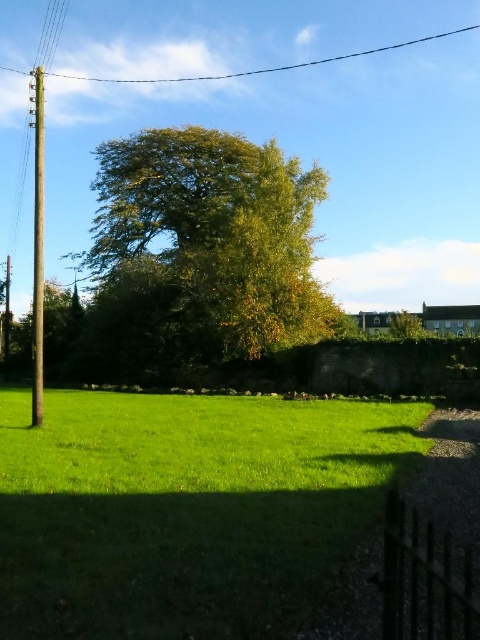
Question: Which point is closer to the camera taking this photo?

Choices:
 (A) (91, 230)
 (B) (39, 208)

Answer: (B)

Question: Is green grass at lower left to the left of green leafy tree at center from the viewer's perspective?

Choices:
 (A) yes
 (B) no

Answer: (B)

Question: Among these objects, which one is nearest to the camera?

Choices:
 (A) green leafy tree at center
 (B) smooth brown pole at left

Answer: (B)

Question: Does green grass at lower left have a lesser width compared to metallic wire at upper center?

Choices:
 (A) yes
 (B) no

Answer: (A)

Question: Does green grass at lower left appear under metallic wire at upper center?

Choices:
 (A) no
 (B) yes

Answer: (B)

Question: Which of the following is the farthest from the observer?

Choices:
 (A) green leafy tree at center
 (B) metallic wire at upper center
 (C) smooth brown pole at left
 (D) green grass at lower left

Answer: (B)